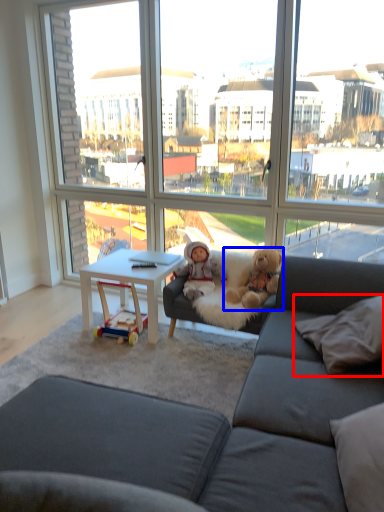
Question: Which object appears closest to the camera in this image, pillow (highlighted by a red box) or teddy bear (highlighted by a blue box)?

Choices:
 (A) pillow
 (B) teddy bear

Answer: (A)